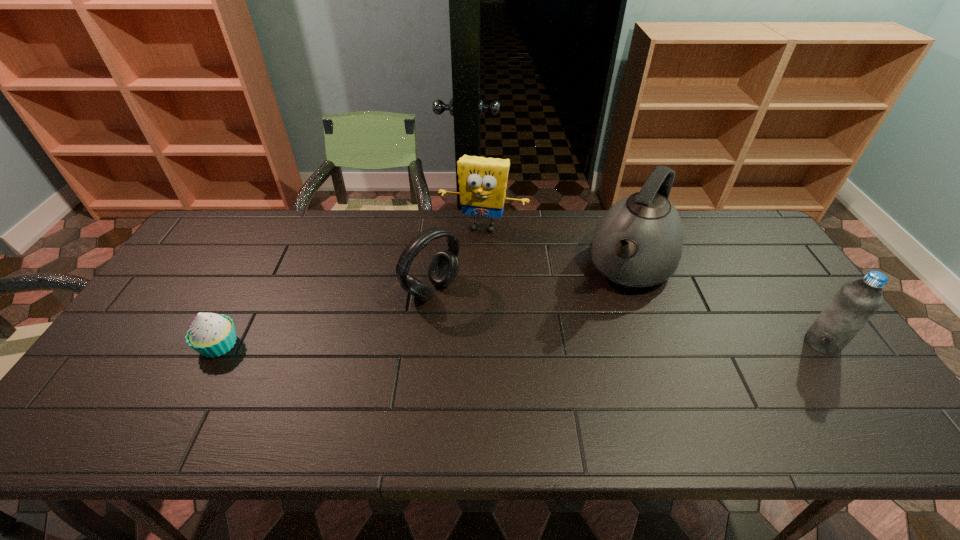
In order to click on the leftmost object in this screenshot , I will do `click(212, 335)`.

In order to click on cupcake in this screenshot , I will do `click(212, 335)`.

Find the location of a particular element. water bottle is located at coordinates (855, 303).

Locate an element on the screen. The width and height of the screenshot is (960, 540). the fourth tallest object is located at coordinates (443, 269).

This screenshot has width=960, height=540. Find the location of `the second object from right to left`. the second object from right to left is located at coordinates (638, 243).

What are the coordinates of `kettle` in the screenshot? It's located at (638, 243).

This screenshot has height=540, width=960. I want to click on sponge, so click(483, 181).

The height and width of the screenshot is (540, 960). In order to click on free space located 0.310m on the right of the leftmost object in this screenshot , I will do (360, 345).

Find the location of a particular element. The image size is (960, 540). free space located on the left of the rightmost object is located at coordinates (745, 342).

At what (x,y) coordinates should I click in order to perform the action: click on vacant region located on the earcups of the headset. Please return your answer as a coordinate pair (x, y). The image size is (960, 540). Looking at the image, I should click on (502, 341).